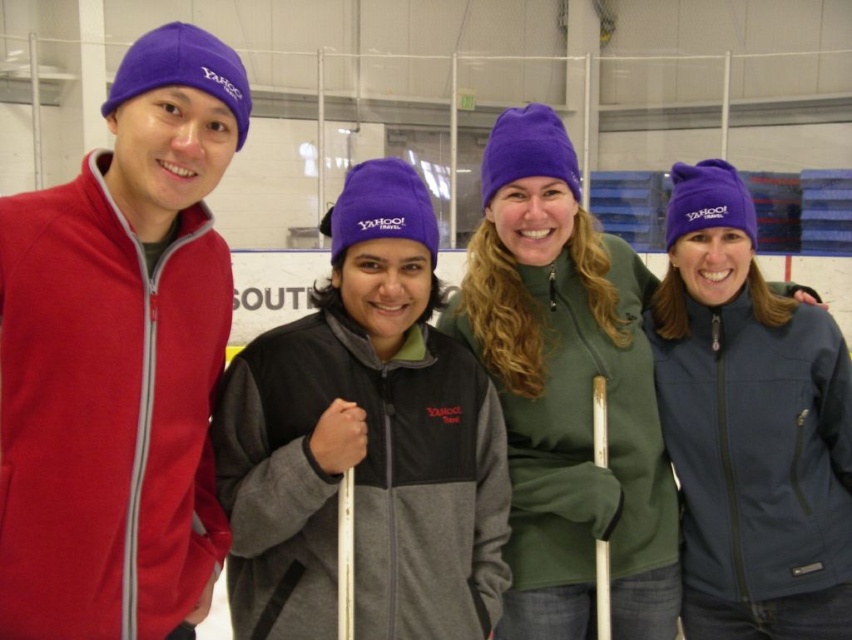
You are planning to take a photo of the group at the ice skating rink. The photographer wants to ensure both the green fleece jacket at center and the navy blue softshell jacket at right are fully visible in the frame. Based on their current positions, is this possible?

The green fleece jacket at center is positioned over the navy blue softshell jacket at right, so the photographer will need to adjust the angle or position to ensure both are fully visible without one blocking the other.

You are standing at the origin point in the image. Which object is located at coordinates point [119,358]?

The point [119,358] corresponds to the matte fleece jacket at left.

You are standing in front of the ice rink and want to hand a pair of ice skates to both the matte black jacket at center and the navy blue softshell jacket at right. Which person should you approach first based on their position?

You should approach the matte black jacket at center first because they are closer to you than the navy blue softshell jacket at right.